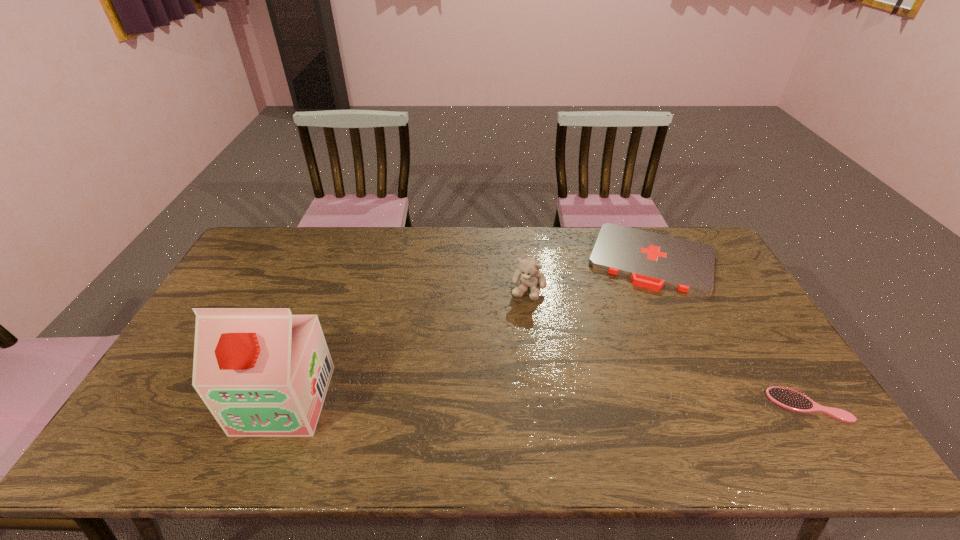
This screenshot has height=540, width=960. In order to click on vacant space in between the third shortest object and the hairbrush in this screenshot , I will do pos(668,347).

Locate an element on the screen. The image size is (960, 540). free spot between the third object from right to left and the first-aid kit is located at coordinates (589, 274).

At what (x,y) coordinates should I click in order to perform the action: click on free spot between the soya milk and the first-aid kit. Please return your answer as a coordinate pair (x, y). Image resolution: width=960 pixels, height=540 pixels. Looking at the image, I should click on (468, 329).

Find the location of a particular element. Image resolution: width=960 pixels, height=540 pixels. vacant space that is in between the tallest object and the first-aid kit is located at coordinates (468, 329).

Where is `object that is the closest to the first-aid kit`? The width and height of the screenshot is (960, 540). object that is the closest to the first-aid kit is located at coordinates (528, 273).

Find the location of a particular element. The image size is (960, 540). object that ranks as the third closest to the teddy bear is located at coordinates (787, 398).

Where is `free region that satisfies the following two spatial constraints: 1. with the cap open on the tallest object; 2. on the left side of the hairbrush`? The height and width of the screenshot is (540, 960). free region that satisfies the following two spatial constraints: 1. with the cap open on the tallest object; 2. on the left side of the hairbrush is located at coordinates (282, 405).

The width and height of the screenshot is (960, 540). In order to click on vacant space that satisfies the following two spatial constraints: 1. with the cap open on the leftmost object; 2. on the left side of the hairbrush in this screenshot , I will do coord(282,405).

Find the location of `free location that satisfies the following two spatial constraints: 1. with the cap open on the hairbrush; 2. on the left side of the leftmost object`. free location that satisfies the following two spatial constraints: 1. with the cap open on the hairbrush; 2. on the left side of the leftmost object is located at coordinates (282, 405).